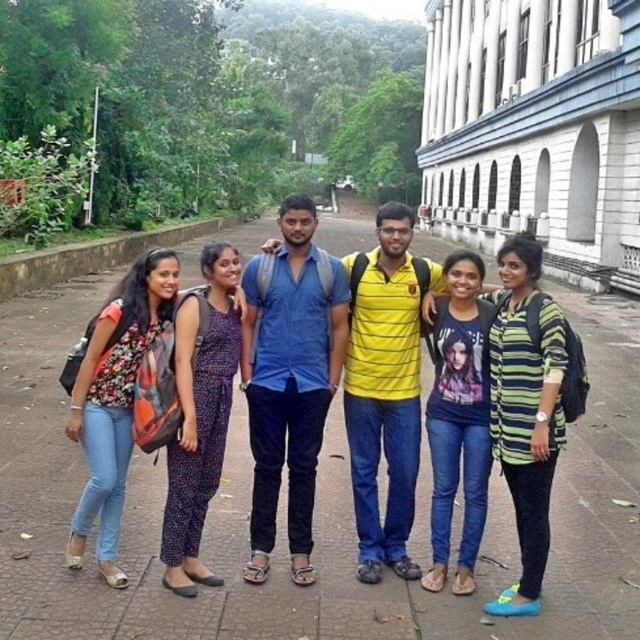
Which is more to the right, floral print shirt at left or purple dotted jumpsuit at center?

Positioned to the right is purple dotted jumpsuit at center.

Between point (74, 372) and point (237, 298), which one is positioned behind?

Positioned behind is point (237, 298).

Identify the location of floral print shirt at left. The height and width of the screenshot is (640, 640). (113, 400).

Does floral print shirt at left have a greater width compared to printed cotton t-shirt at center?

Yes, floral print shirt at left is wider than printed cotton t-shirt at center.

Does point (106, 499) lie in front of point (435, 573)?

Yes, it is.

Find the location of `floral print shirt at left`. floral print shirt at left is located at coordinates (113, 400).

The width and height of the screenshot is (640, 640). Identify the location of floral print shirt at left. (x=113, y=400).

Is blue denim shirt at center to the left of floral print shirt at left from the viewer's perspective?

In fact, blue denim shirt at center is to the right of floral print shirt at left.

Can you confirm if blue denim shirt at center is shorter than floral print shirt at left?

Incorrect, blue denim shirt at center's height does not fall short of floral print shirt at left's.

Identify the location of blue denim shirt at center. (289, 381).